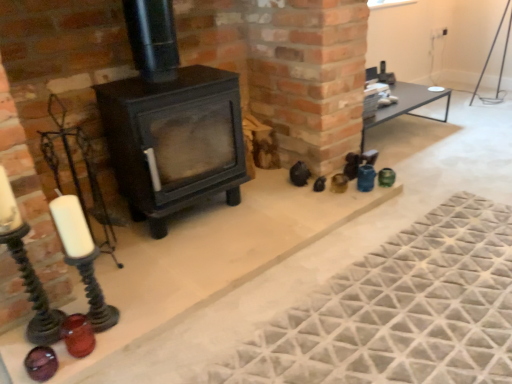
Locate an element on the screen. free space to the left of translucent amber glass candle holder at lower left is located at coordinates (40, 342).